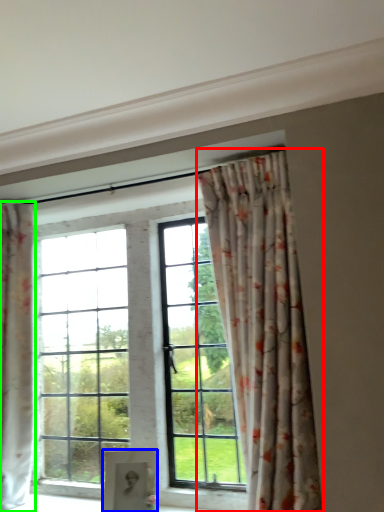
Question: Which object is the farthest from curtain (highlighted by a red box)? Choose among these: furniture (highlighted by a blue box) or curtain (highlighted by a green box).

Choices:
 (A) furniture
 (B) curtain

Answer: (B)